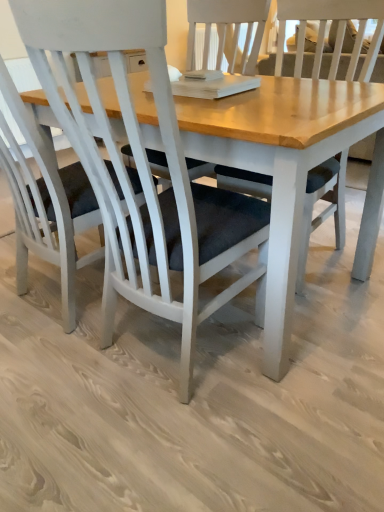
Image resolution: width=384 pixels, height=512 pixels. Find the location of `vacant area situated to the left side of white matte chair at center, which is counted as the 1th chair, starting from the right`. vacant area situated to the left side of white matte chair at center, which is counted as the 1th chair, starting from the right is located at coordinates (45, 384).